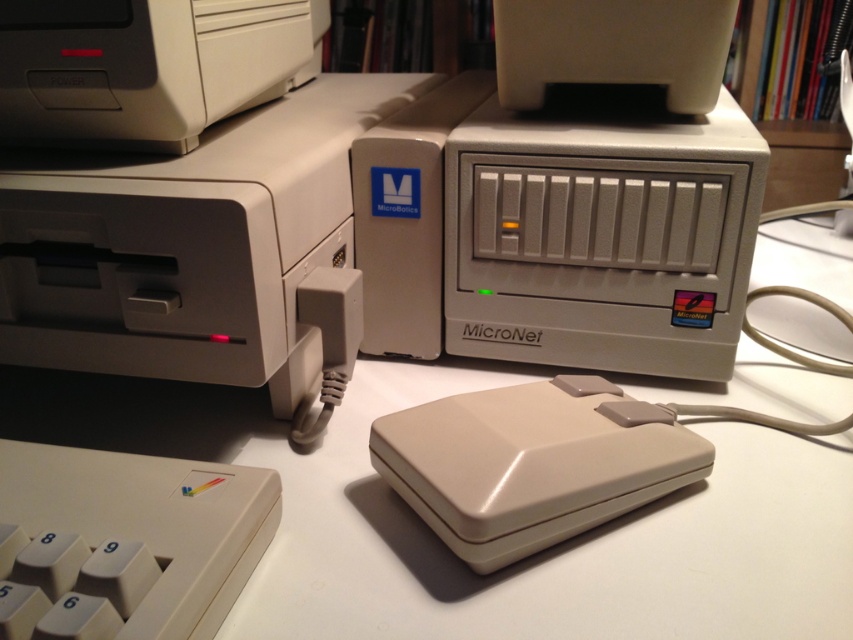
Does white plastic table at center have a lesser width compared to matte white printer at upper left?

No, white plastic table at center is not thinner than matte white printer at upper left.

Between white plastic table at center and matte white printer at upper left, which one is positioned lower?

white plastic table at center is below.

Is point (665, 561) behind point (195, 48)?

No, it is not.

Identify the location of white plastic table at center. The width and height of the screenshot is (853, 640). (450, 552).

Looking at this image, which is more to the left, beige plastic mouse at center or matte white printer at upper left?

matte white printer at upper left

Can you confirm if beige plastic mouse at center is taller than matte white printer at upper left?

Incorrect, beige plastic mouse at center's height is not larger of matte white printer at upper left's.

I want to click on beige plastic mouse at center, so click(x=532, y=464).

Does white plastic table at center have a smaller size compared to matte plastic printer at upper left?

Incorrect, white plastic table at center is not smaller in size than matte plastic printer at upper left.

Can you confirm if white plastic table at center is positioned to the left of matte plastic printer at upper left?

In fact, white plastic table at center is to the right of matte plastic printer at upper left.

Between point (701, 552) and point (378, 116), which one is positioned behind?

Positioned behind is point (378, 116).

The width and height of the screenshot is (853, 640). I want to click on white plastic table at center, so click(450, 552).